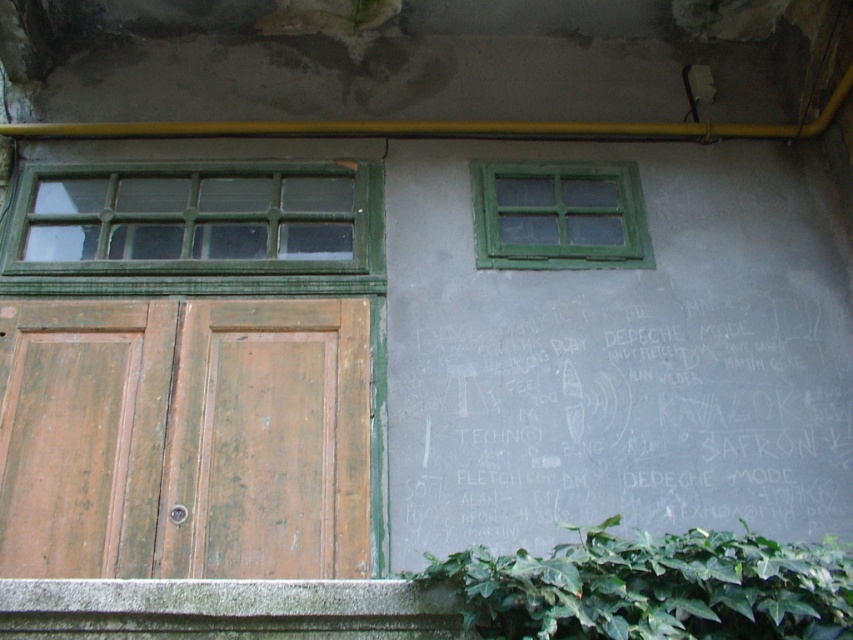
Who is positioned more to the right, weathered wood door at left or green leafy ivy at lower right?

From the viewer's perspective, green leafy ivy at lower right appears more on the right side.

Is weathered wood door at left to the right of green leafy ivy at lower right from the viewer's perspective?

Incorrect, weathered wood door at left is not on the right side of green leafy ivy at lower right.

At what (x,y) coordinates should I click in order to perform the action: click on weathered wood door at left. Please return your answer as a coordinate pair (x, y). This screenshot has width=853, height=640. Looking at the image, I should click on (184, 438).

Between black chalkboard at right and green leafy ivy at lower right, which one has more height?

With more height is black chalkboard at right.

Does black chalkboard at right appear on the right side of green leafy ivy at lower right?

Yes, black chalkboard at right is to the right of green leafy ivy at lower right.

Between point (415, 294) and point (471, 621), which one is positioned behind?

The point (415, 294) is more distant.

You are a GUI agent. You are given a task and a screenshot of the screen. Output one action in this format:
    pyautogui.click(x=<x>, y=<y>)
    Task: Click on the black chalkboard at right
    The width and height of the screenshot is (853, 640).
    Given the screenshot: What is the action you would take?
    pyautogui.click(x=614, y=408)

Does black chalkboard at right lie in front of weathered wood door at left?

No, black chalkboard at right is further to the viewer.

Image resolution: width=853 pixels, height=640 pixels. In order to click on black chalkboard at right in this screenshot , I will do `click(614, 408)`.